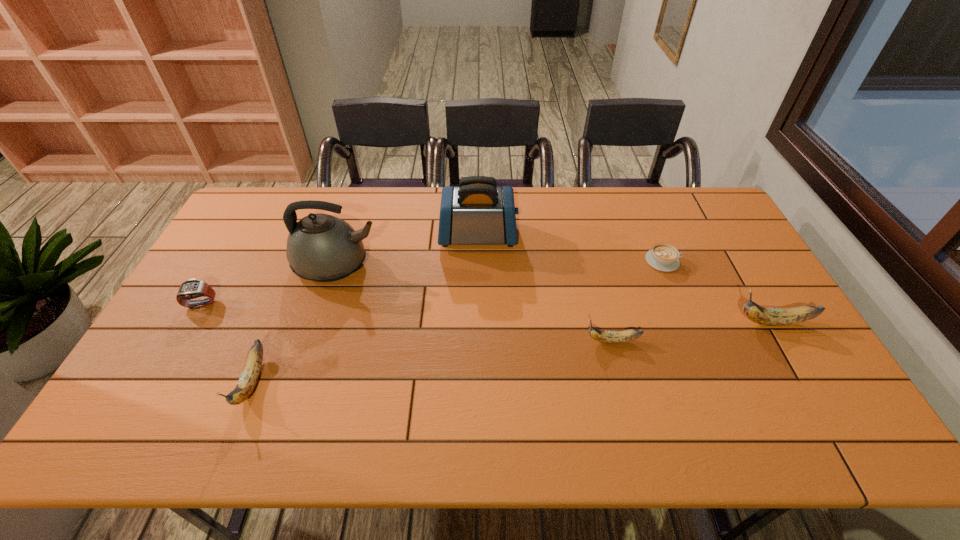
If equal spacing is desired by inserting an extra banana among them, please point out a free spot for this new banana. Please provide its 2D coordinates. Your answer should be formatted as a tuple, i.e. [(x, y)], where the tuple contains the x and y coordinates of a point satisfying the conditions above.

[(439, 360)]